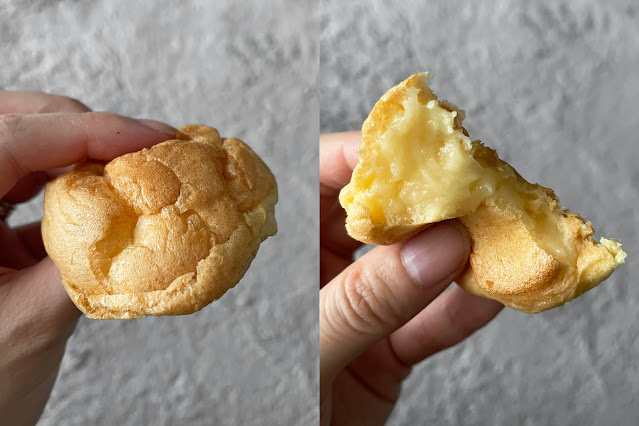
Where is `wall`? This screenshot has width=639, height=426. wall is located at coordinates (602, 73).